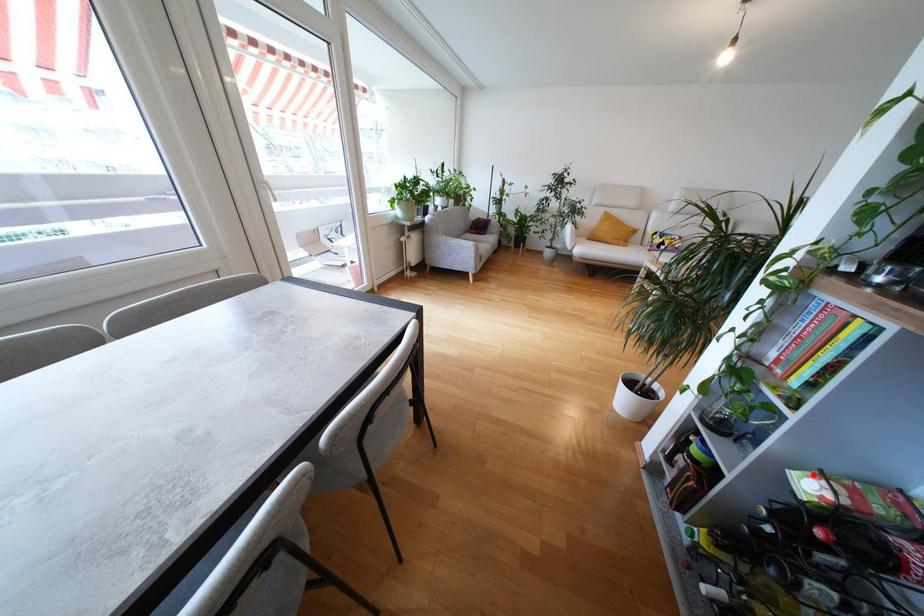
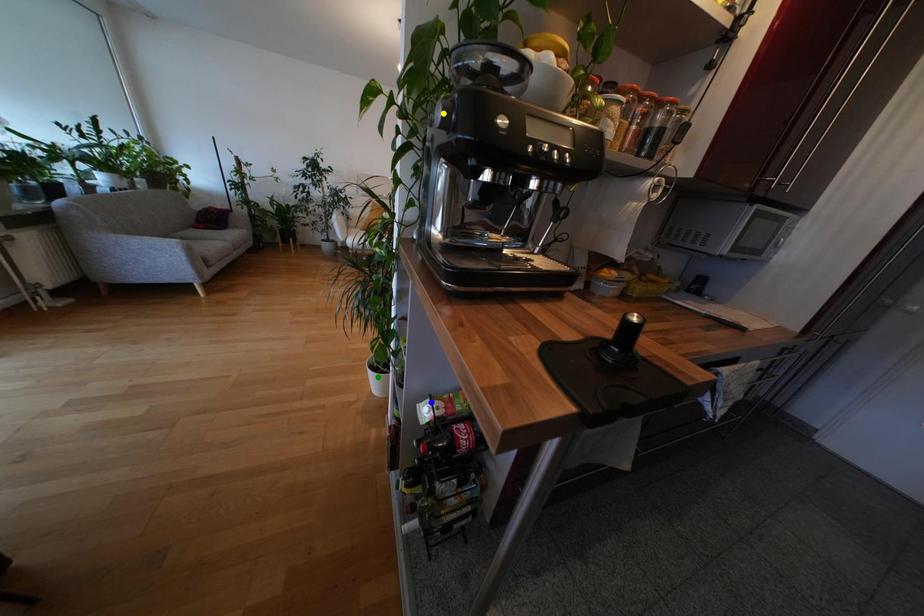
Question: I am providing you with two images of the same scene from different viewpoints. A red point is marked on the first image. You are given multiple points on the second image. In image 2, which mark is for the same physical point as the one in image 1?

Choices:
 (A) blue point
 (B) yellow point
 (C) green point

Answer: (A)